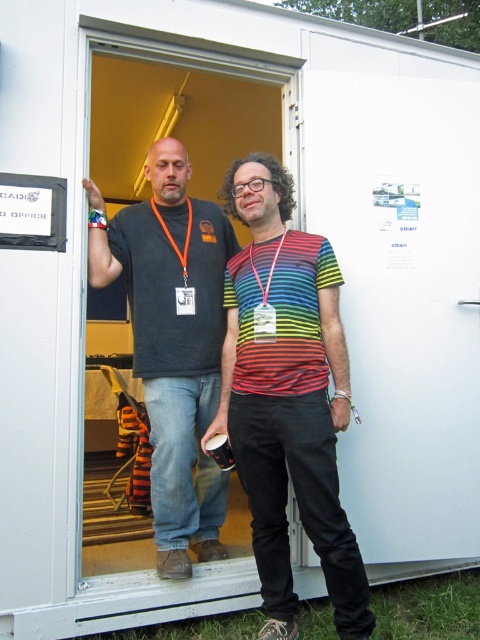
Looking at the two people in front of the white portable office trailer, can you determine which object is positioned higher between the rainbow striped shirt at center and the orange fabric lanyard at center?

The orange fabric lanyard at center is positioned higher than the rainbow striped shirt at center.